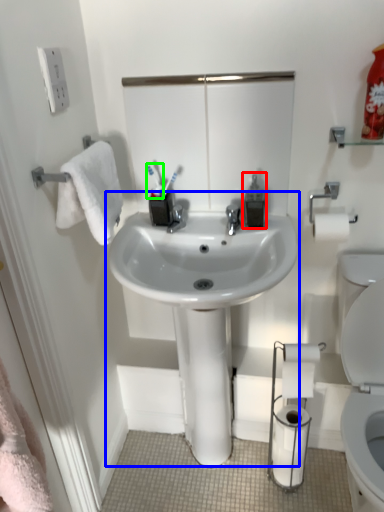
Question: Based on their relative distances, which object is farther from soap dispenser (highlighted by a red box)? Choose from sink (highlighted by a blue box) and toothbrush (highlighted by a green box).

Choices:
 (A) sink
 (B) toothbrush

Answer: (A)